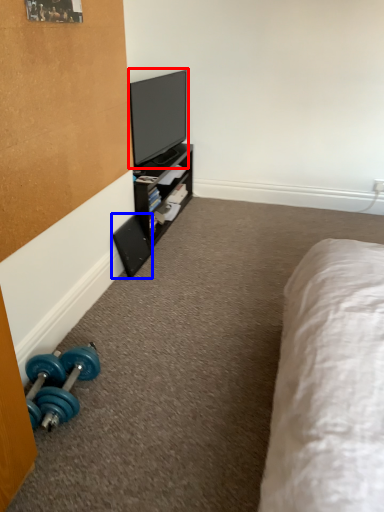
Question: Which point is closer to the camera, television (highlighted by a red box) or speaker (highlighted by a blue box)?

Choices:
 (A) television
 (B) speaker

Answer: (B)